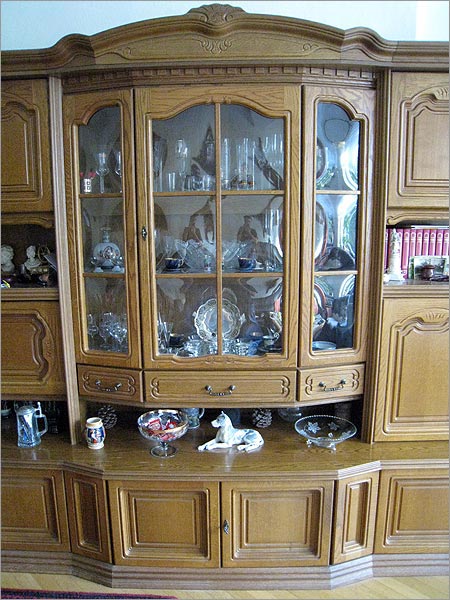
Image resolution: width=450 pixels, height=600 pixels. I want to click on plate, so click(x=205, y=318).